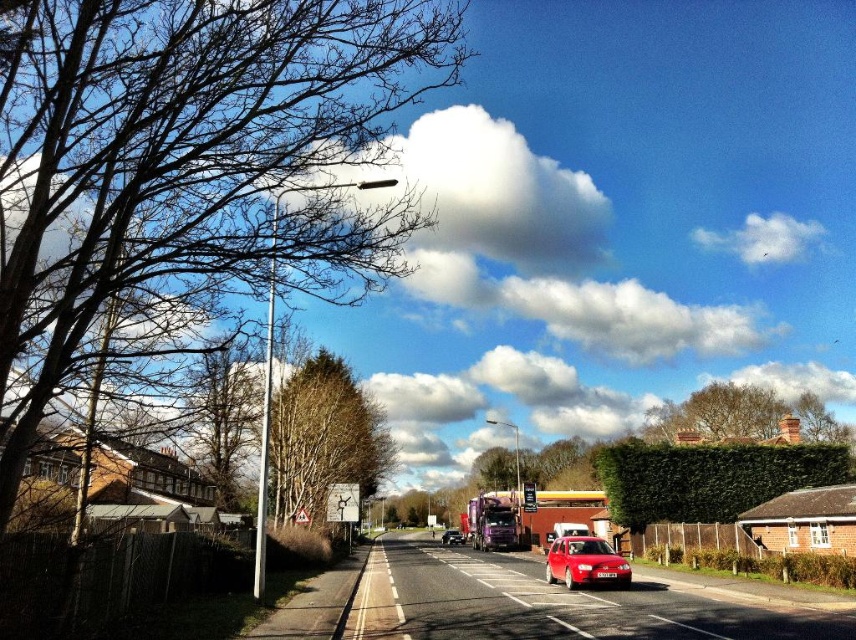
Consider the image. Who is taller, bare branches at left or shiny red car at center?

Standing taller between the two is bare branches at left.

Is bare branches at left bigger than shiny red car at center?

Correct, bare branches at left is larger in size than shiny red car at center.

Is point (179, 266) positioned after point (560, 561)?

No, (179, 266) is closer to viewer.

I want to click on bare branches at left, so click(189, 163).

Between point (327, 396) and point (444, 532), which one is positioned in front?

Positioned in front is point (327, 396).

Who is more distant from viewer, (349, 467) or (453, 532)?

The point (453, 532) is behind.

Image resolution: width=856 pixels, height=640 pixels. What do you see at coordinates (324, 436) in the screenshot?
I see `smooth brown tree at center` at bounding box center [324, 436].

Where is `smooth brown tree at center`? This screenshot has width=856, height=640. smooth brown tree at center is located at coordinates (324, 436).

Find the location of a particular element. The image size is (856, 640). shiny red car at center is located at coordinates (586, 563).

Does shiny red car at center appear on the left side of metallic purple truck at center?

In fact, shiny red car at center is to the right of metallic purple truck at center.

You are a GUI agent. You are given a task and a screenshot of the screen. Output one action in this format:
    pyautogui.click(x=<x>, y=<y>)
    Task: Click on the shiny red car at center
    Image resolution: width=856 pixels, height=640 pixels.
    Given the screenshot: What is the action you would take?
    586,563

You are a GUI agent. You are given a task and a screenshot of the screen. Output one action in this format:
    pyautogui.click(x=<x>, y=<y>)
    Task: Click on the shiny red car at center
    The height and width of the screenshot is (640, 856).
    Given the screenshot: What is the action you would take?
    pyautogui.click(x=586, y=563)